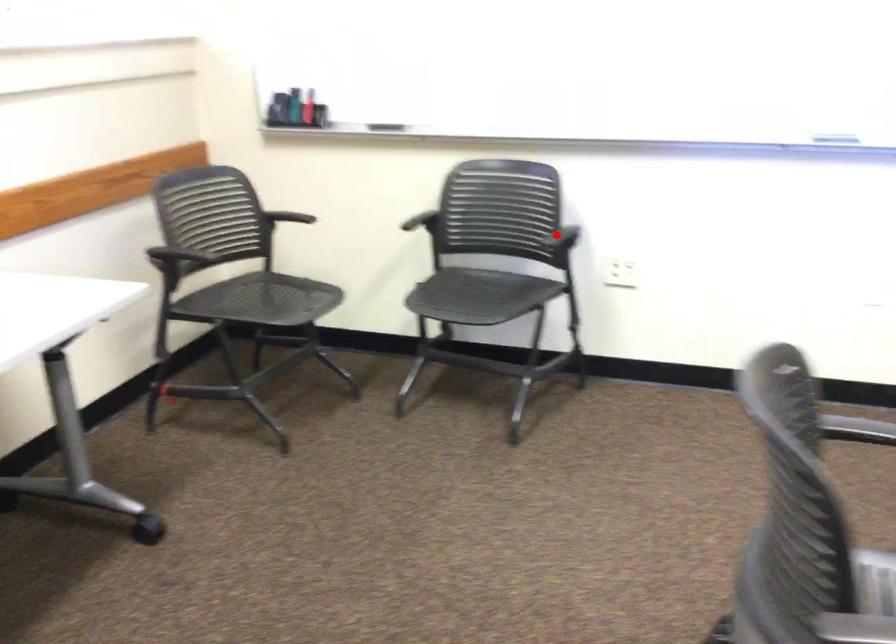
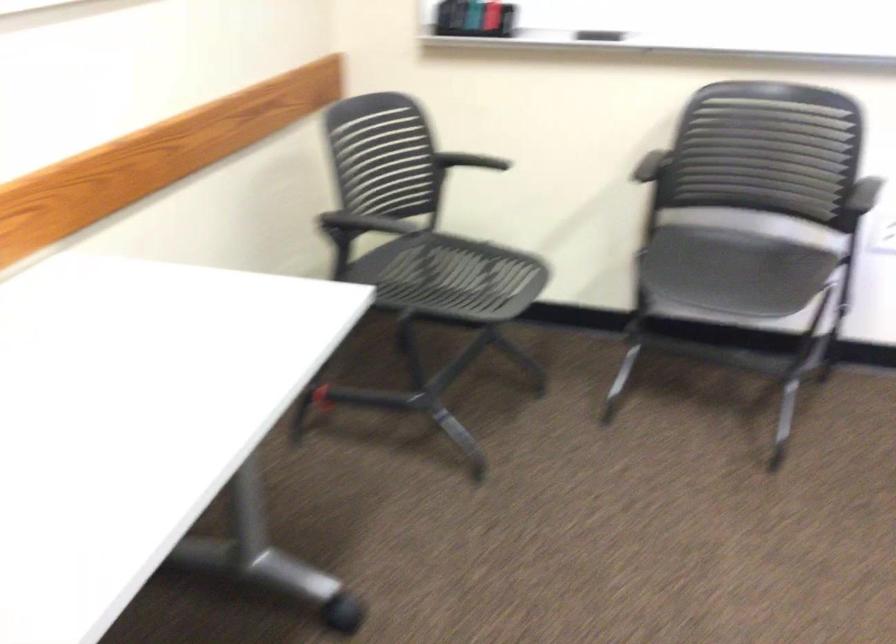
Question: I am providing you with two images of the same scene from different viewpoints. A red point is shown in image1. For the corresponding object point in image2, is it positioned nearer or farther from the camera?

Choices:
 (A) Nearer
 (B) Farther

Answer: (A)